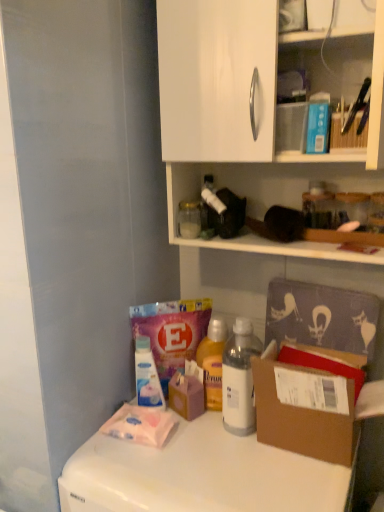
Question: From a real-world perspective, is white glossy counter top at lower left above or below brown cardboard box at lower right?

Choices:
 (A) above
 (B) below

Answer: (B)

Question: Considering the positions of white glossy counter top at lower left and brown cardboard box at lower right in the image, is white glossy counter top at lower left wider or thinner than brown cardboard box at lower right?

Choices:
 (A) thin
 (B) wide

Answer: (B)

Question: Estimate the real-world distances between objects in this image. Which object is closer to the transparent plastic bottle at lower center, acting as the first bottle starting from the bottom?

Choices:
 (A) white plastic bottle at center, which ranks as the second bottle in top-to-bottom order
 (B) white glossy counter top at lower left
 (C) brown cardboard box at lower right
 (D) clear glass jar at upper center, the 3th bottle when ordered from bottom to top

Answer: (A)

Question: Based on their relative distances, which object is nearer to the transparent plastic bottle at lower center, acting as the first bottle starting from the bottom?

Choices:
 (A) white plastic bottle at center, the third bottle when ordered from left to right
 (B) brown cardboard box at lower right
 (C) clear glass jar at upper center, acting as the second bottle starting from the left
 (D) white glossy counter top at lower left

Answer: (A)